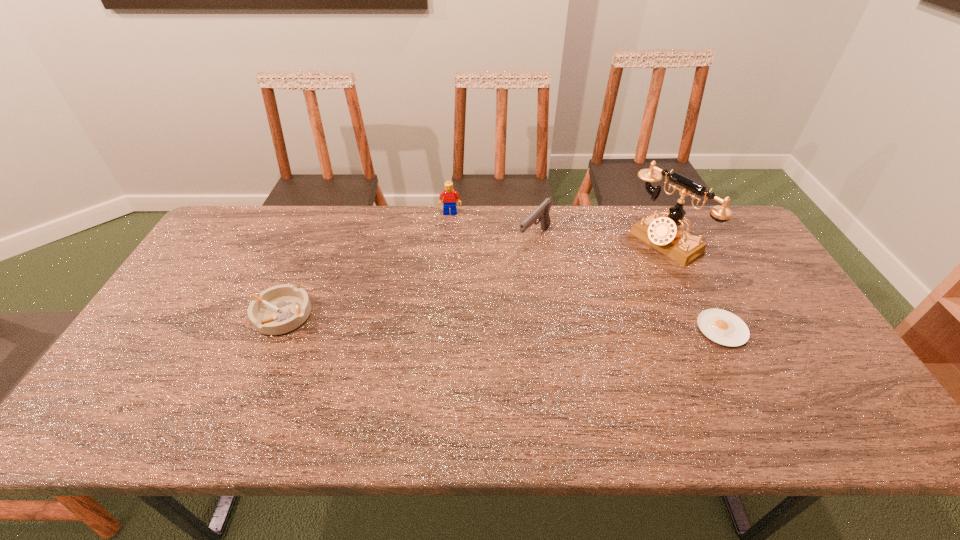
Locate an element on the screen. The image size is (960, 540). free space located 0.290m at the barrel of the third object from right to left is located at coordinates (472, 309).

Identify the location of vacant space situated at the barrel of the third object from right to left. This screenshot has width=960, height=540. (501, 278).

I want to click on vacant space located 0.210m on the front-facing side of the farthest object, so click(x=451, y=255).

Where is `vacant area situated on the front-facing side of the farthest object`? This screenshot has width=960, height=540. vacant area situated on the front-facing side of the farthest object is located at coordinates (451, 241).

This screenshot has height=540, width=960. I want to click on free space located on the front-facing side of the farthest object, so click(451, 232).

The height and width of the screenshot is (540, 960). I want to click on vacant space located on the dial of the telephone, so click(x=564, y=308).

This screenshot has width=960, height=540. I want to click on free space located on the dial of the telephone, so click(x=635, y=264).

Where is `free point located on the dial of the telephone`? free point located on the dial of the telephone is located at coordinates (569, 305).

Locate an element on the screen. Image resolution: width=960 pixels, height=540 pixels. pistol that is positioned at the far edge is located at coordinates pyautogui.click(x=542, y=212).

Where is `Lego positioned at the far edge`? Lego positioned at the far edge is located at coordinates (449, 196).